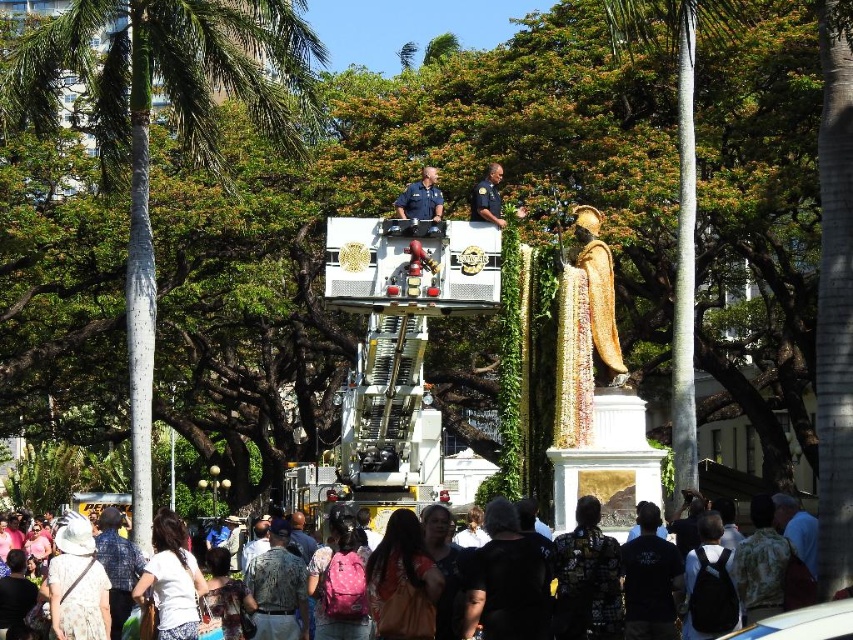
What object is located at the coordinates point (173,116) in the scene?

The point (173,116) corresponds to the smooth gray trunk at left.

You are a photographer trying to capture a photo of the blue uniform at center without the white metallic fire truck at center blocking the view. Is there a position where you can stand to achieve this?

The white metallic fire truck at center is wider than the blue uniform at center, so you can position yourself to the side of the fire truck to avoid blocking the view of the blue uniform at center.

You are a photographer at the event and want to capture both the smooth gray trunk at left and the dark clothing crowd at lower center in a single frame. Based on their positions, which object should you position closer to the left side of your camera viewfinder?

The smooth gray trunk at left should be positioned closer to the left side of your camera viewfinder since it is located to the left of the dark clothing crowd at lower center.